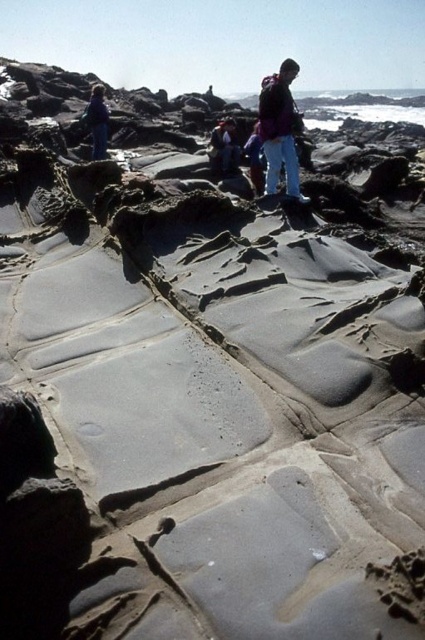
You are a photographer planning to capture a wide shot of the coastal scene. You notice the blue denim jacket at left and the blue jeans at center. Which object should you ensure stays in frame to maintain balance in your composition, considering their sizes?

The blue denim jacket at left is bigger than blue jeans at center, so to maintain balance in your composition, ensure the larger blue denim jacket at left stays in frame.

In the scene shown: You are standing at the point marked by the coordinates point (96, 122) in the image. What is the closest object to you?

The closest object to you at point (96, 122) is the blue denim jacket at left.